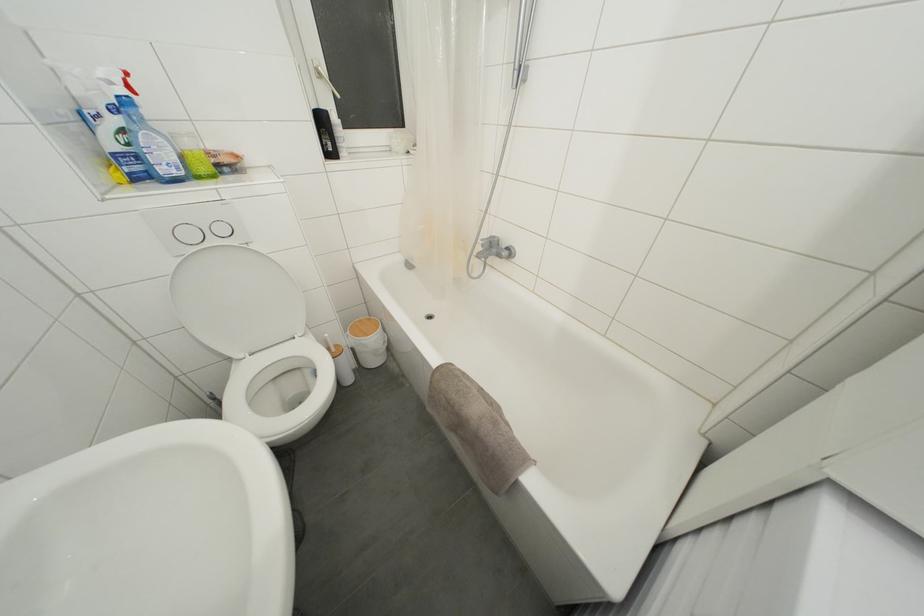
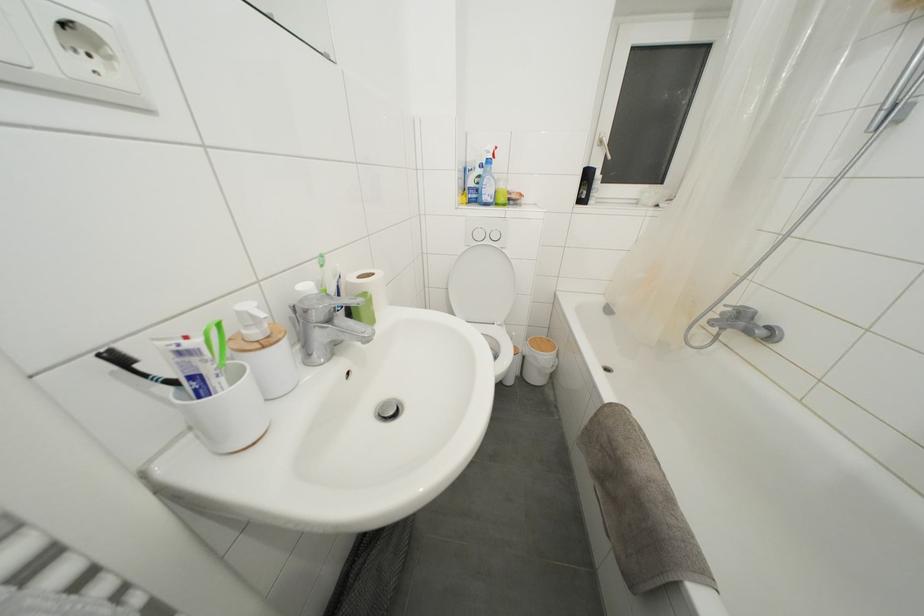
Find the pixel in the second image that matches [323,79] in the first image.

(604, 148)